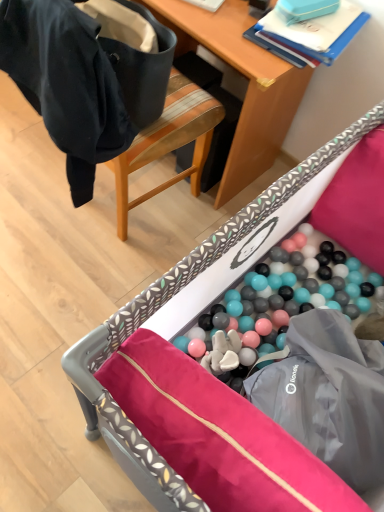
Locate an element on the screen. vacant area that lies in front of black fabric chair at upper left is located at coordinates (77, 273).